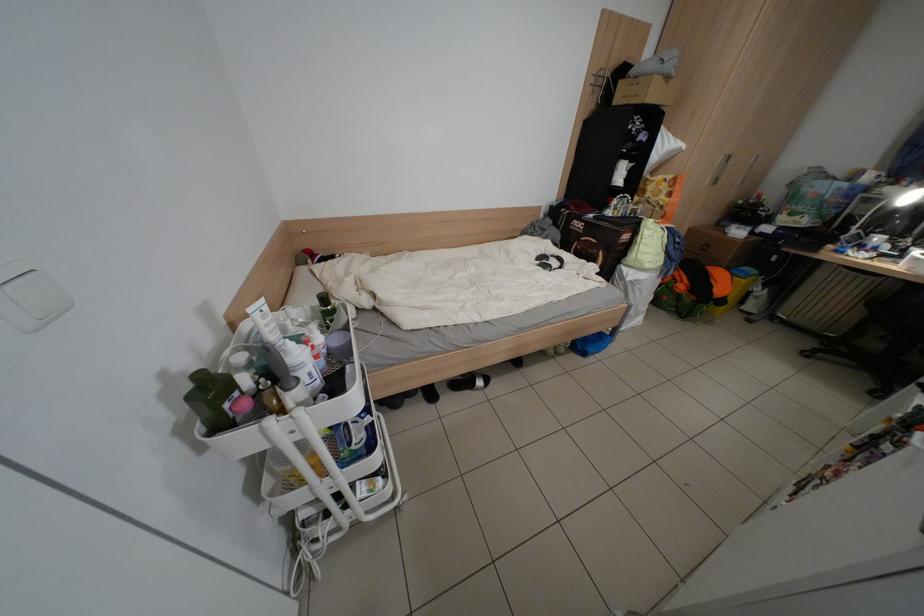
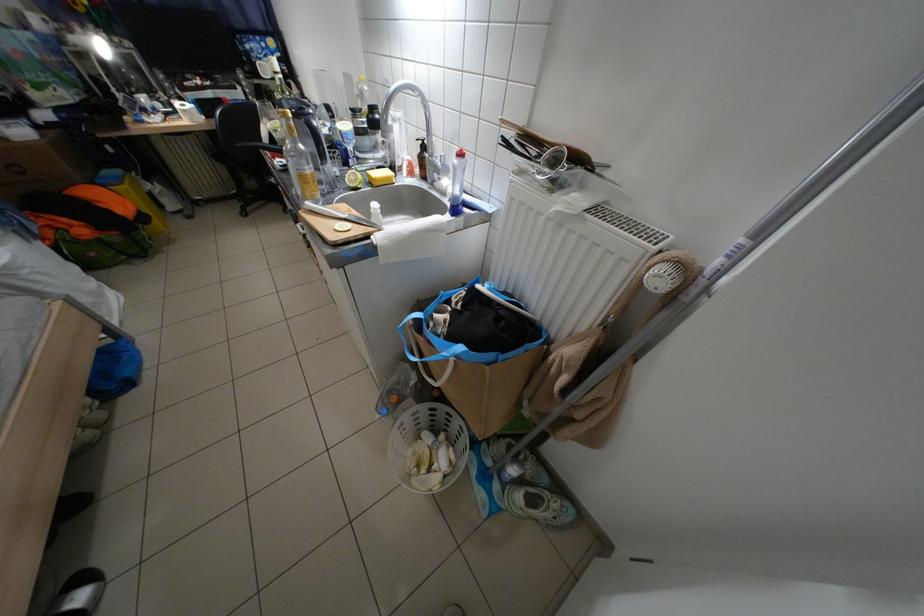
The first image is from the beginning of the video and the second image is from the end. How did the camera likely rotate when shooting the video?

The camera rotated toward right-down.